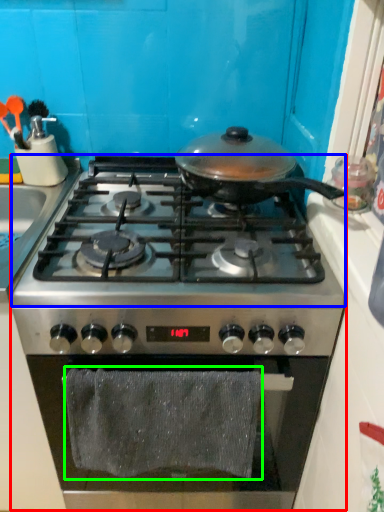
Question: Which is nearer to the gas stove (highlighted by a red box)? gas stove (highlighted by a blue box) or bath towel (highlighted by a green box).

Choices:
 (A) gas stove
 (B) bath towel

Answer: (B)